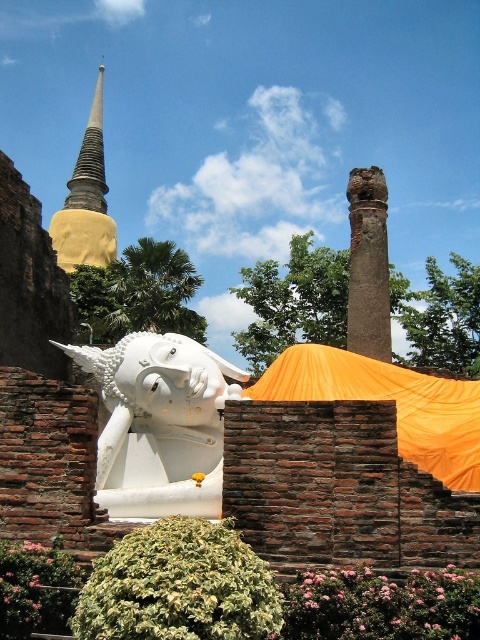
You are a photographer standing in front of the reclining Buddha statue. You want to take a photo that includes both the orange fabric canopy at center and the smooth gold spire at upper left. Which object will appear larger in your photo?

The orange fabric canopy at center will appear larger in the photo because it is closer to the viewer than the smooth gold spire at upper left.

You are a visitor at the temple and want to take a photo of the white glossy statue at center without any obstructions. Is the orange fabric canopy at center blocking the view of the statue?

The white glossy statue at center is located below the orange fabric canopy at center, so the canopy is blocking the view of the statue.

You are a visitor at the temple and want to take a photo of the orange fabric canopy at center and the smooth gold spire at upper left. Which object appears wider in the photo?

The smooth gold spire at upper left appears wider in the photo because its width is greater than the orange fabric canopy at center.